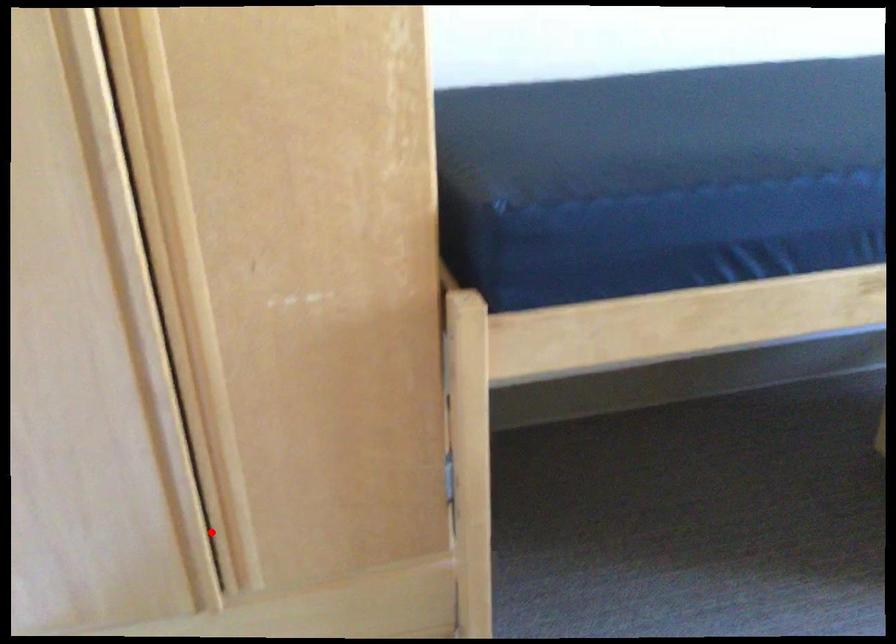
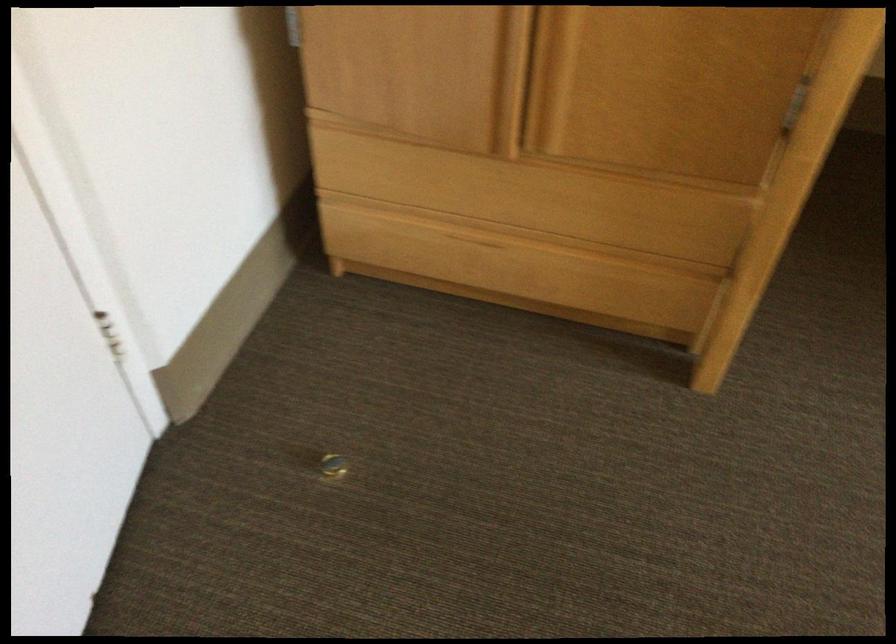
Find the pixel in the second image that matches the highlighted location in the first image.

(533, 79)